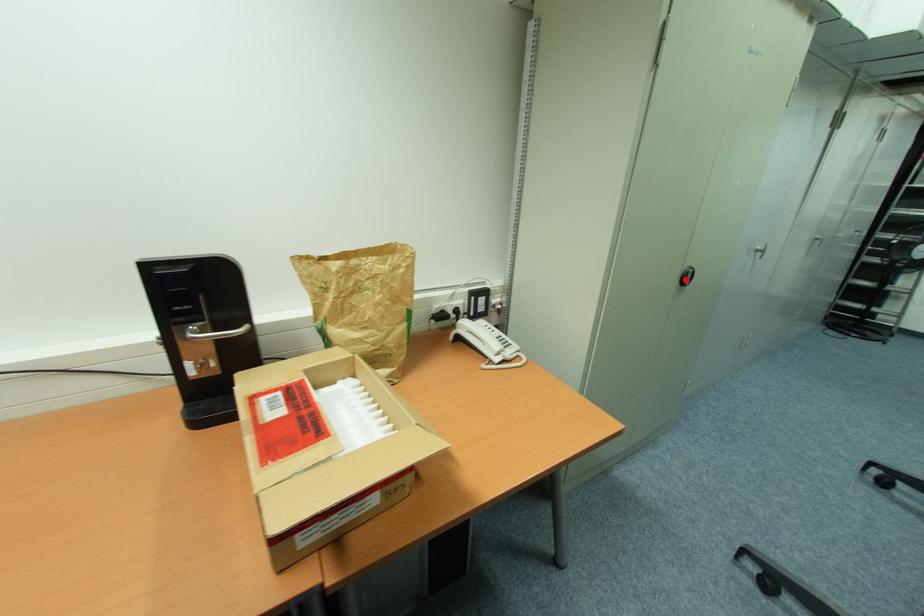
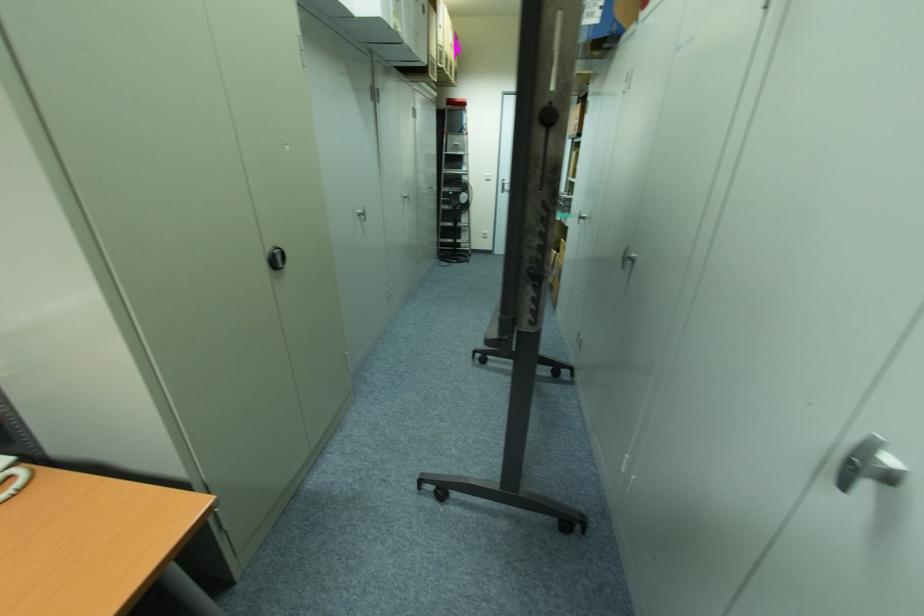
The point at the highlighted location is marked in the first image. Where is the corresponding point in the second image?

(278, 262)